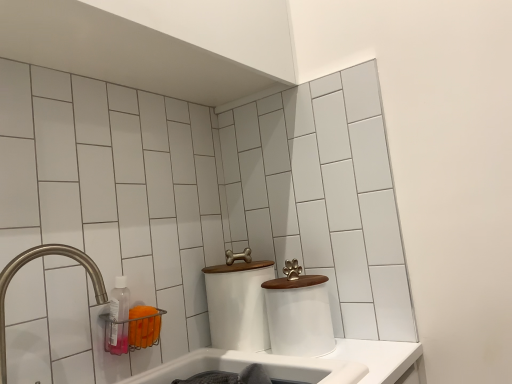
Question: Can you confirm if white matte toilet paper at center, which is counted as the 2th toilet paper, starting from the left, is taller than transparent plastic bottle at lower left?

Choices:
 (A) no
 (B) yes

Answer: (B)

Question: Can you confirm if white matte toilet paper at center, which is counted as the 2th toilet paper, starting from the left, is positioned to the right of transparent plastic bottle at lower left?

Choices:
 (A) yes
 (B) no

Answer: (A)

Question: Is white matte toilet paper at center, which is counted as the 2th toilet paper, starting from the left, turned away from transparent plastic bottle at lower left?

Choices:
 (A) yes
 (B) no

Answer: (B)

Question: From a real-world perspective, is white matte toilet paper at center, which is counted as the 2th toilet paper, starting from the left, on top of transparent plastic bottle at lower left?

Choices:
 (A) no
 (B) yes

Answer: (A)

Question: Could you tell me if white matte toilet paper at center, which is counted as the 2th toilet paper, starting from the left, is turned towards transparent plastic bottle at lower left?

Choices:
 (A) no
 (B) yes

Answer: (A)

Question: From the image's perspective, is white matte toilet paper at center, the 1th toilet paper in the right-to-left sequence, above transparent plastic bottle at lower left?

Choices:
 (A) no
 (B) yes

Answer: (A)

Question: Can you confirm if white plastic bath at lower center is wider than white matte toilet paper at center, placed as the first toilet paper when sorted from left to right?

Choices:
 (A) yes
 (B) no

Answer: (A)

Question: Is white plastic bath at lower center located outside white matte toilet paper at center, the second toilet paper from the right?

Choices:
 (A) yes
 (B) no

Answer: (A)

Question: Can you confirm if white plastic bath at lower center is positioned to the right of white matte toilet paper at center, placed as the first toilet paper when sorted from left to right?

Choices:
 (A) no
 (B) yes

Answer: (A)

Question: Is the position of white plastic bath at lower center more distant than that of white matte toilet paper at center, the second toilet paper from the right?

Choices:
 (A) yes
 (B) no

Answer: (B)

Question: Are white plastic bath at lower center and white matte toilet paper at center, placed as the first toilet paper when sorted from left to right, beside each other?

Choices:
 (A) no
 (B) yes

Answer: (A)

Question: Does white plastic bath at lower center appear on the left side of white matte toilet paper at center, placed as the first toilet paper when sorted from left to right?

Choices:
 (A) no
 (B) yes

Answer: (B)

Question: From a real-world perspective, does white plastic bath at lower center stand above brushed metal faucet at left?

Choices:
 (A) no
 (B) yes

Answer: (A)